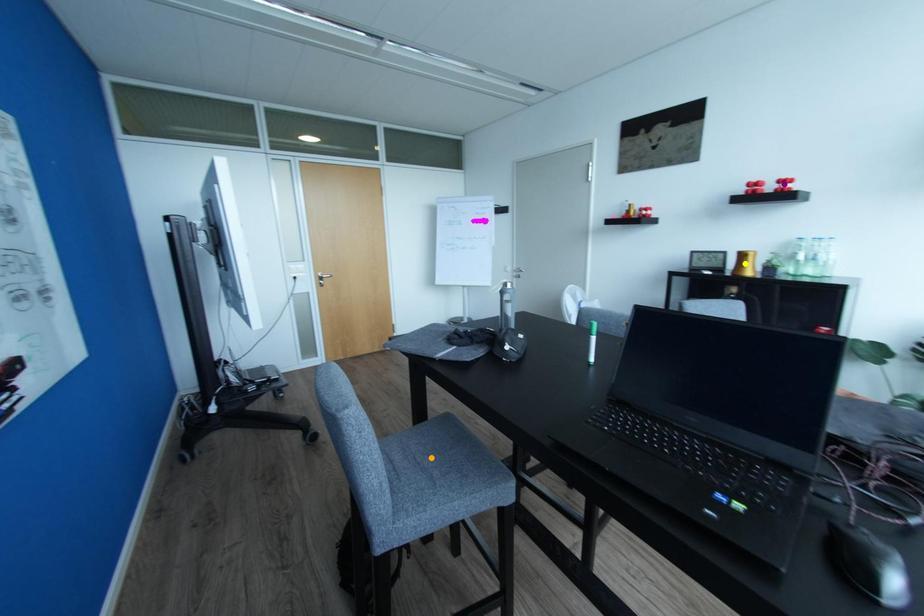
Order these from nearest to farthest:
purple point, yellow point, orange point

orange point, purple point, yellow point